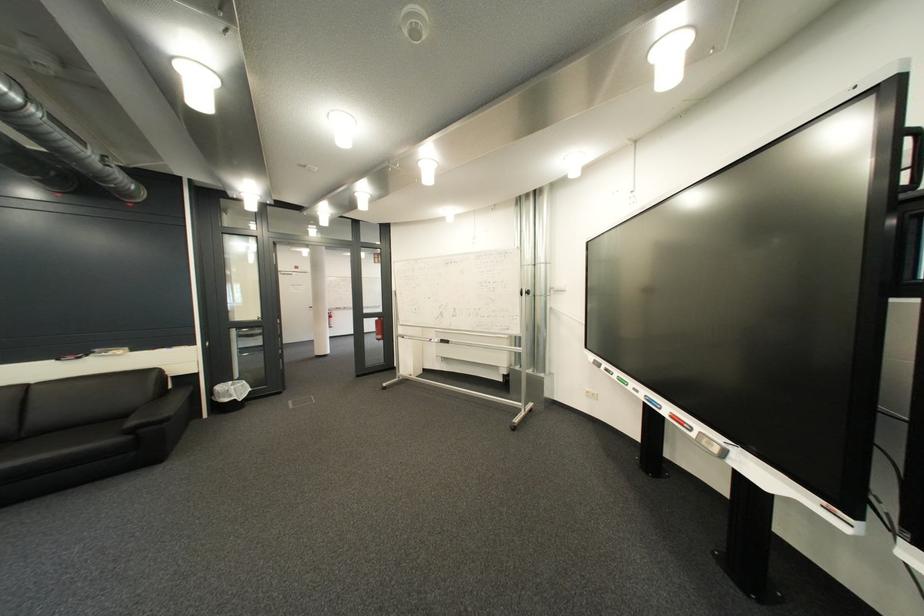
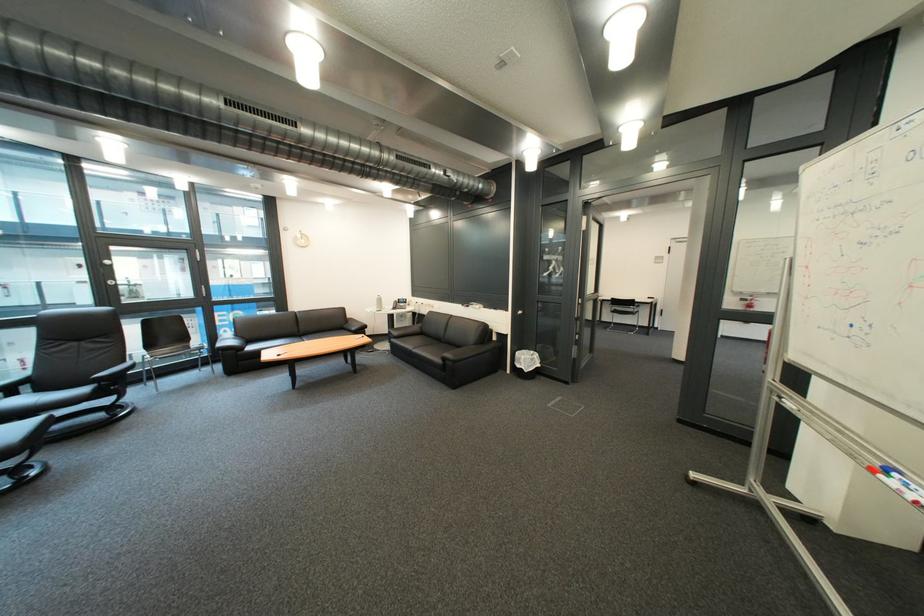
In the second image, find the point that corresponds to pixel 444 341 in the first image.

(901, 472)